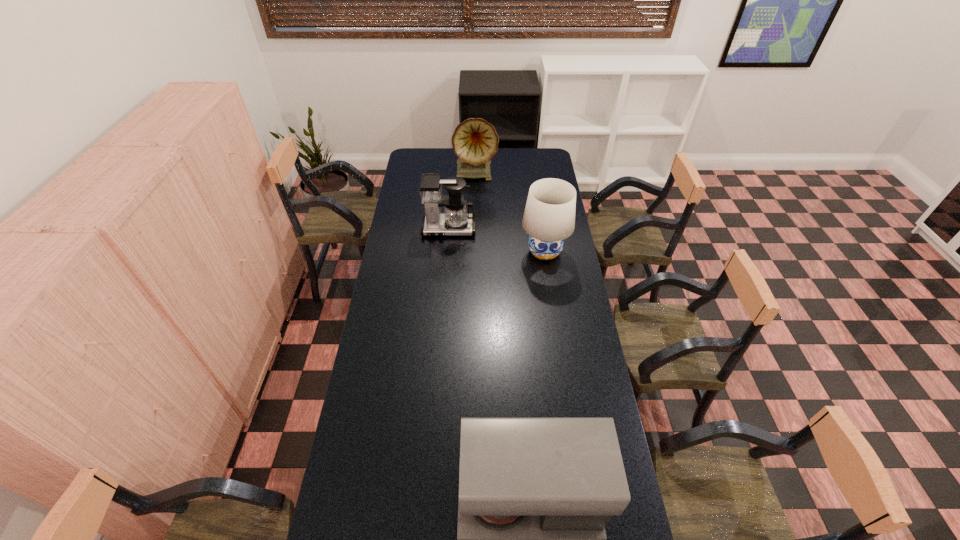
The height and width of the screenshot is (540, 960). Identify the location of the farthest object. (475, 141).

Where is `lampshade`? lampshade is located at coordinates [549, 217].

Where is `the shorter coffee maker`? The height and width of the screenshot is (540, 960). the shorter coffee maker is located at coordinates (456, 221).

At what (x,y) coordinates should I click in order to perform the action: click on the farther coffee maker. Please return your answer as a coordinate pair (x, y). This screenshot has width=960, height=540. Looking at the image, I should click on (456, 221).

I want to click on free region located 0.180m from the horn of the farthest object, so click(475, 208).

Identify the location of free region located on the front-facing side of the lampshade. (550, 287).

I want to click on blank space located 0.360m at the front of the shortest object where the controls are located, so click(x=444, y=294).

Image resolution: width=960 pixels, height=540 pixels. What are the coordinates of `object present at the far edge` in the screenshot? It's located at (475, 141).

The image size is (960, 540). Identify the location of object that is positioned at the left edge. (456, 221).

In order to click on object that is at the right edge in this screenshot , I will do `click(549, 217)`.